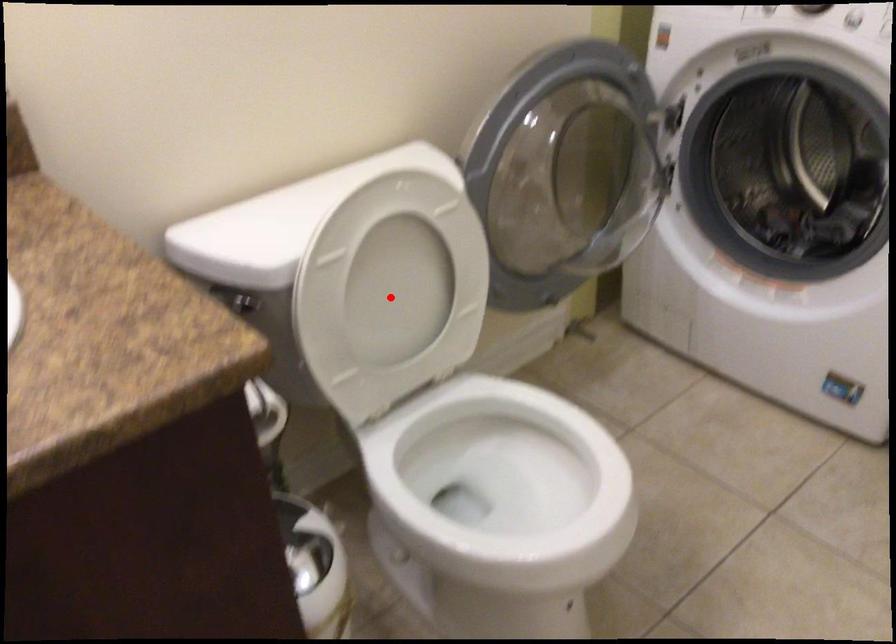
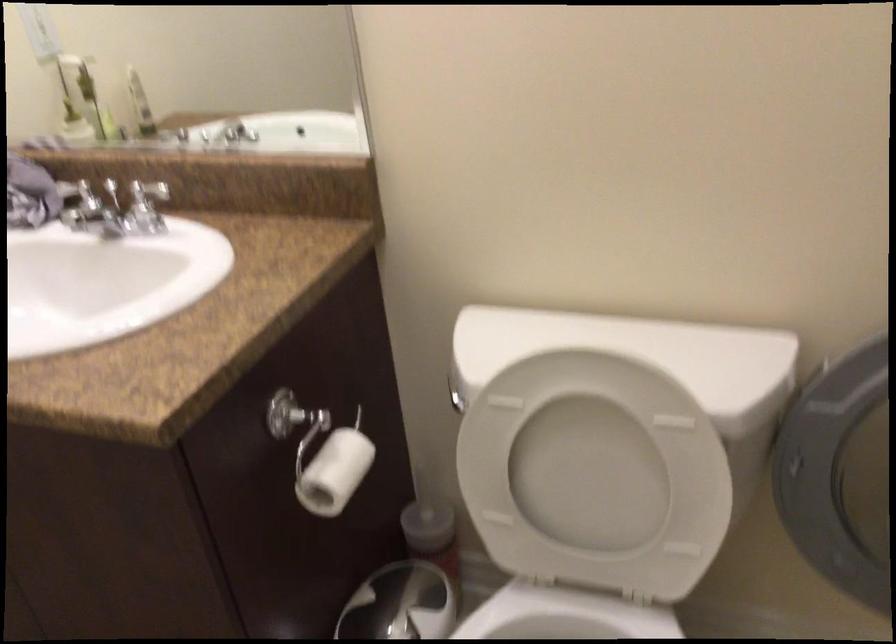
Question: I am providing you with two images of the same scene from different viewpoints. Given a red point in image1, look at the same physical point in image2. Is it:

Choices:
 (A) Closer to the viewpoint
 (B) Farther from the viewpoint

Answer: (A)